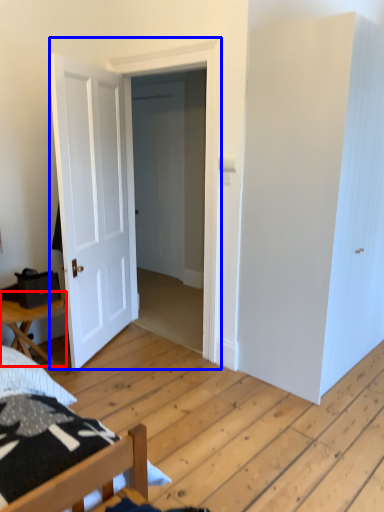
Question: Which of the following is the farthest to the observer, table (highlighted by a red box) or door (highlighted by a blue box)?

Choices:
 (A) table
 (B) door

Answer: (B)